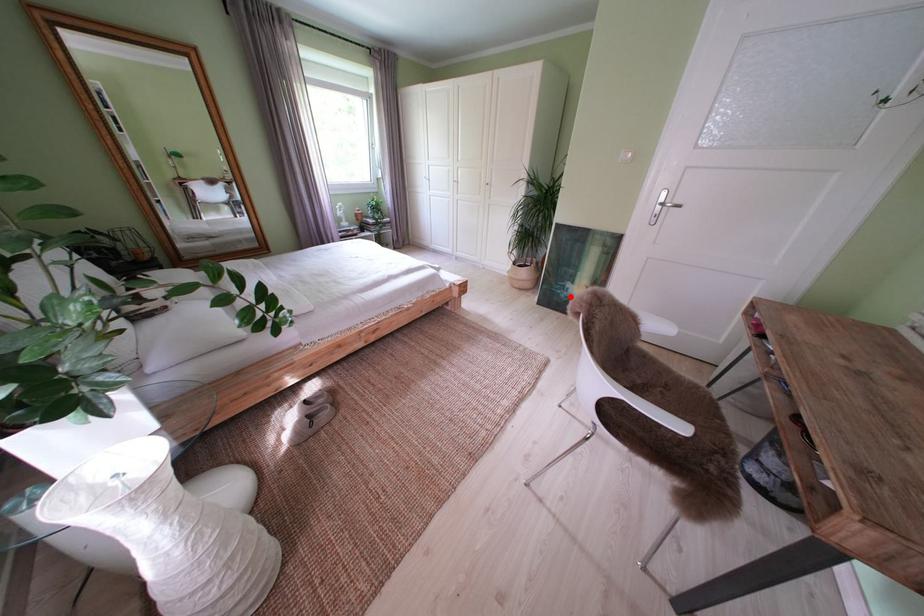
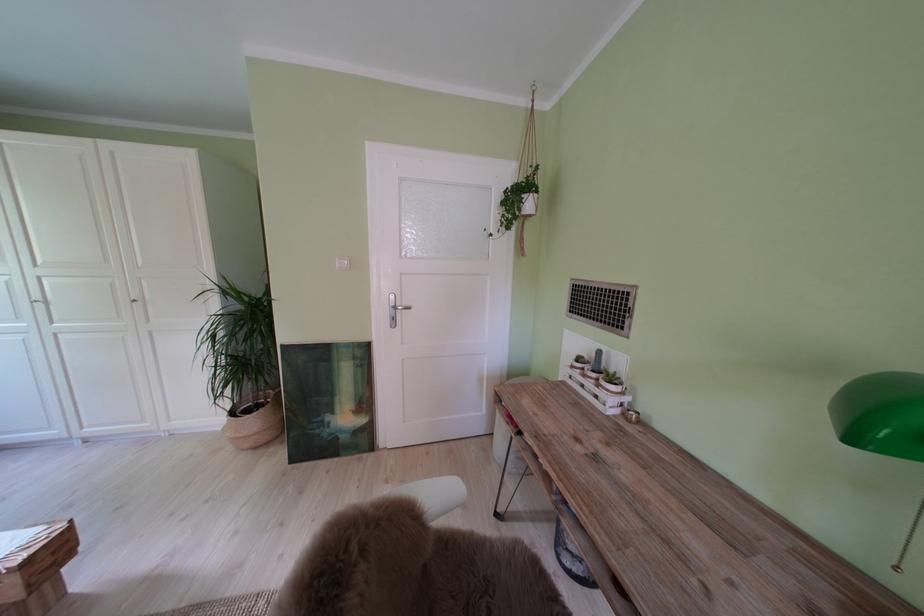
Question: I am providing you with two images of the same scene from different viewpoints. A red point is marked on the first image. Is the red point's position out of view in image 2?

Choices:
 (A) Yes
 (B) No

Answer: (B)